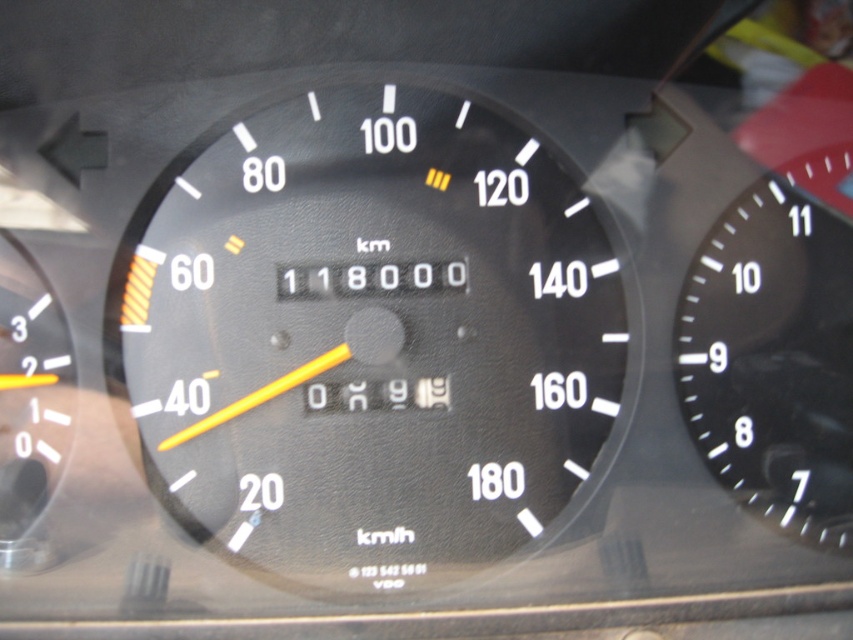
Question: Is black matte speedometer at center wider than black matte speedometer at right?

Choices:
 (A) no
 (B) yes

Answer: (B)

Question: In this image, where is black matte speedometer at center located relative to black matte speedometer at right?

Choices:
 (A) below
 (B) above

Answer: (B)

Question: Does black matte speedometer at center have a greater width compared to black matte speedometer at right?

Choices:
 (A) yes
 (B) no

Answer: (A)

Question: Which point is farther to the camera?

Choices:
 (A) black matte speedometer at right
 (B) black matte speedometer at center

Answer: (A)

Question: Which of the following is the farthest from the observer?

Choices:
 (A) (685, 308)
 (B) (341, 529)

Answer: (A)